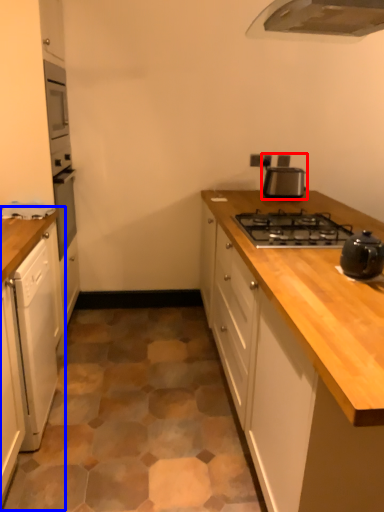
Question: Which object is closer to the camera taking this photo, kitchen appliance (highlighted by a red box) or cabinetry (highlighted by a blue box)?

Choices:
 (A) kitchen appliance
 (B) cabinetry

Answer: (B)